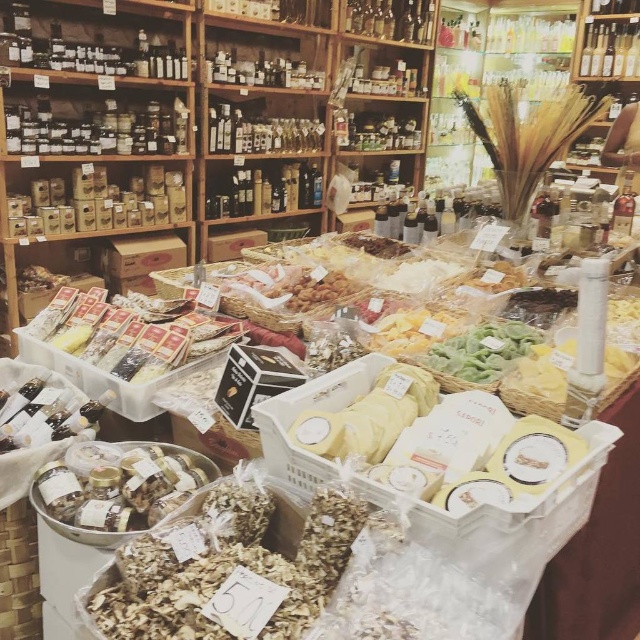
Does translucent plastic jars at center appear on the left side of green leafy vegetables at center?

Correct, you'll find translucent plastic jars at center to the left of green leafy vegetables at center.

Is translucent plastic jars at center smaller than green leafy vegetables at center?

Incorrect, translucent plastic jars at center is not smaller in size than green leafy vegetables at center.

Between point (74, 468) and point (490, 349), which one is positioned in front?

Point (74, 468) is more forward.

You are a GUI agent. You are given a task and a screenshot of the screen. Output one action in this format:
    pyautogui.click(x=<x>, y=<y>)
    Task: Click on the translucent plastic jars at center
    Image resolution: width=640 pixels, height=640 pixels.
    Given the screenshot: What is the action you would take?
    pyautogui.click(x=116, y=486)

How distant is brown crumbly at center from translucent plastic jars at center?

brown crumbly at center is 11.21 inches away from translucent plastic jars at center.

Is point (136, 564) positioned in front of point (48, 516)?

Yes, it is.

Describe the element at coordinates (228, 572) in the screenshot. I see `brown crumbly at center` at that location.

You are a GUI agent. You are given a task and a screenshot of the screen. Output one action in this format:
    pyautogui.click(x=<x>, y=<y>)
    Task: Click on the brown crumbly at center
    Image resolution: width=640 pixels, height=640 pixels.
    Given the screenshot: What is the action you would take?
    pyautogui.click(x=228, y=572)

Does brown crumbly at center have a larger size compared to green leafy vegetables at center?

Yes.

In the scene shown: Is brown crumbly at center closer to the viewer compared to green leafy vegetables at center?

Yes.

Based on the photo, who is more distant from viewer, [282,576] or [460,364]?

Positioned behind is point [460,364].

This screenshot has height=640, width=640. In order to click on brown crumbly at center in this screenshot , I will do `click(228, 572)`.